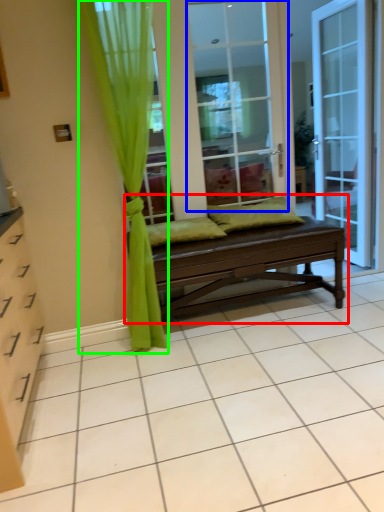
Question: Considering the real-world distances, which object is closest to studio couch (highlighted by a red box)? screen door (highlighted by a blue box) or curtain (highlighted by a green box).

Choices:
 (A) screen door
 (B) curtain

Answer: (B)